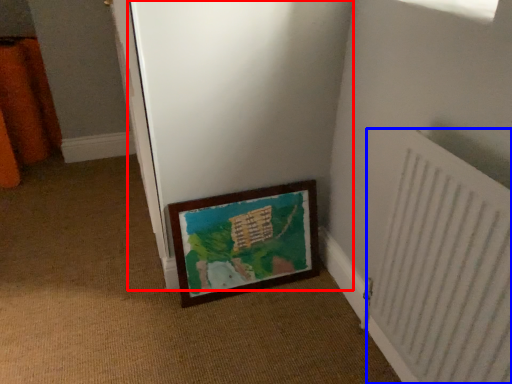
Question: Which object is further to the camera taking this photo, screen door (highlighted by a red box) or radiator (highlighted by a blue box)?

Choices:
 (A) screen door
 (B) radiator

Answer: (A)